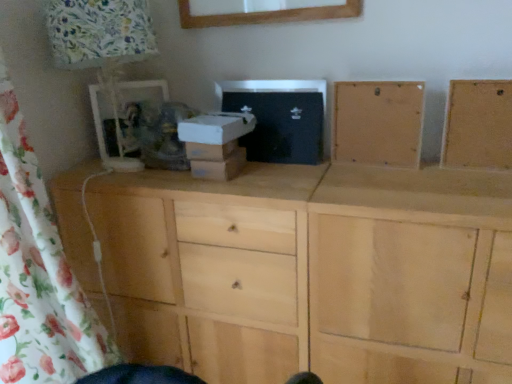
Find the location of a particular element. This screenshot has height=384, width=512. vacant space situated on the left part of natural wood frame at upper right, positioned as the second cabinetry in left-to-right order is located at coordinates (441, 173).